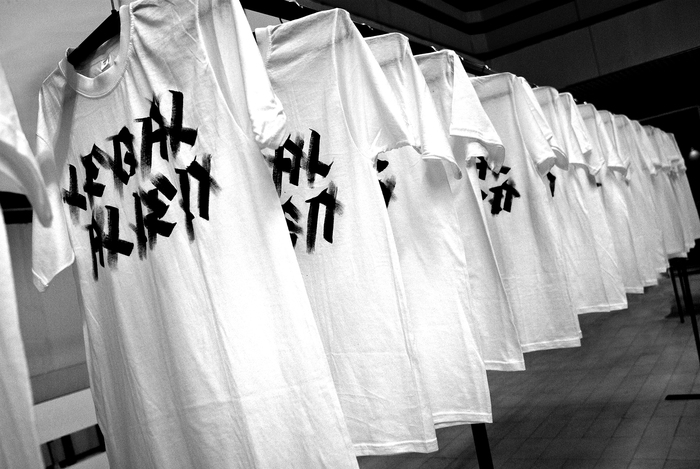
The height and width of the screenshot is (469, 700). In order to click on hanger hooks in this screenshot , I will do `click(113, 5)`, `click(297, 5)`, `click(367, 26)`, `click(432, 46)`, `click(461, 58)`, `click(484, 68)`.